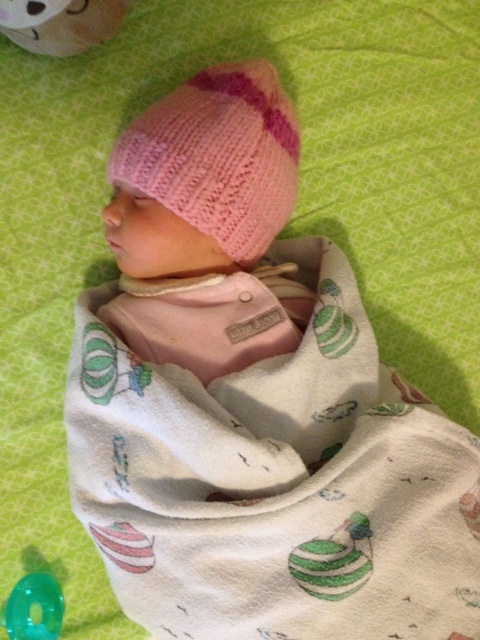
Question: Can you confirm if white cotton swaddle at center is bigger than translucent green ring at lower left?

Choices:
 (A) yes
 (B) no

Answer: (A)

Question: Which object is positioned closest to the white cotton swaddle at center?

Choices:
 (A) pink knitted hat at upper center
 (B) translucent green ring at lower left

Answer: (A)

Question: Among these points, which one is nearest to the camera?

Choices:
 (A) (37, 636)
 (B) (72, 419)
 (C) (191, 193)

Answer: (C)

Question: Is white cotton swaddle at center further to the viewer compared to translucent green ring at lower left?

Choices:
 (A) no
 (B) yes

Answer: (A)

Question: Is white cotton swaddle at center to the right of translucent green ring at lower left from the viewer's perspective?

Choices:
 (A) no
 (B) yes

Answer: (B)

Question: Which object is positioned closest to the translucent green ring at lower left?

Choices:
 (A) white cotton swaddle at center
 (B) pink knitted hat at upper center

Answer: (A)